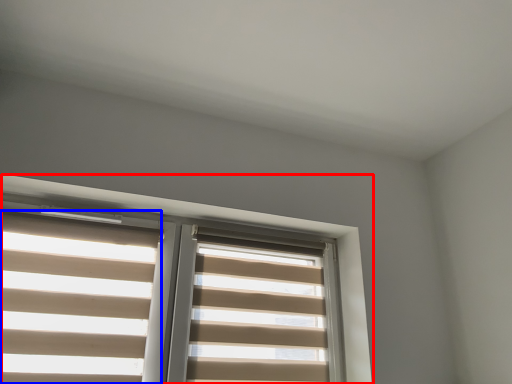
Question: Which object is further to the camera taking this photo, window (highlighted by a red box) or blind (highlighted by a blue box)?

Choices:
 (A) window
 (B) blind

Answer: (B)